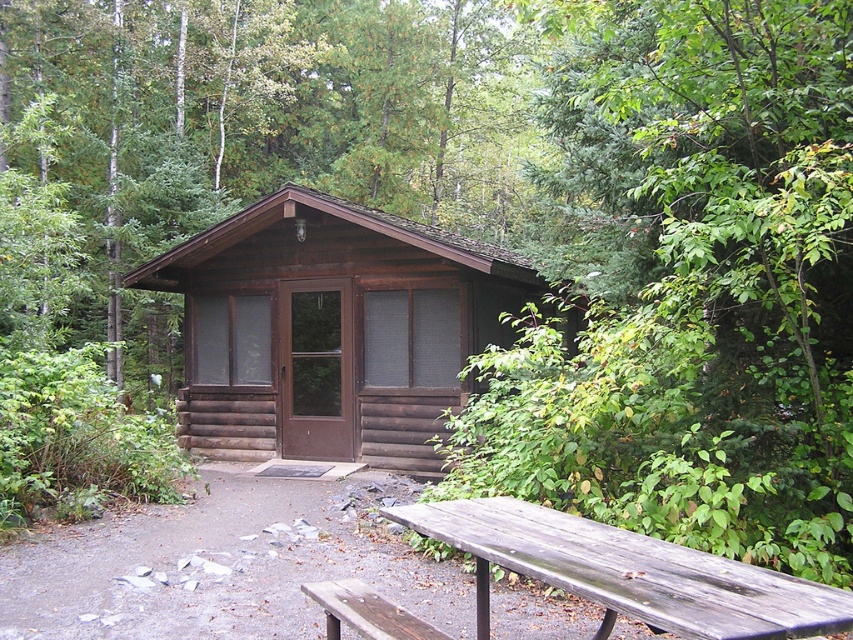
Question: Can you confirm if brown log cabin at center is bigger than weathered wood picnic table at lower center?

Choices:
 (A) yes
 (B) no

Answer: (A)

Question: Observing the image, what is the correct spatial positioning of brown log cabin at center in reference to weathered wood picnic table at lower center?

Choices:
 (A) right
 (B) left

Answer: (B)

Question: Can you confirm if brown log cabin at center is positioned above weathered wood picnic table at lower center?

Choices:
 (A) yes
 (B) no

Answer: (A)

Question: Among these points, which one is farthest from the camera?

Choices:
 (A) (370, 422)
 (B) (785, 637)

Answer: (A)